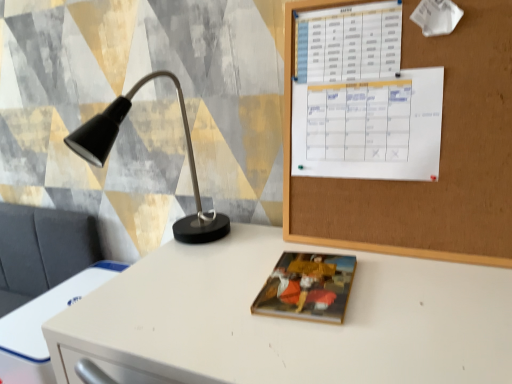
This screenshot has width=512, height=384. I want to click on blank space situated above white plastic drawer at lower left (from a real-world perspective), so click(x=59, y=298).